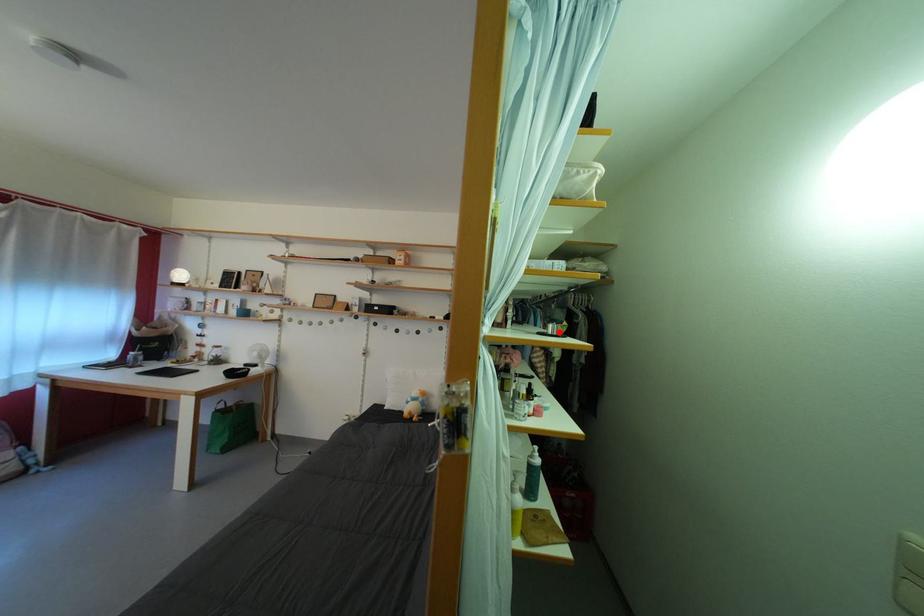
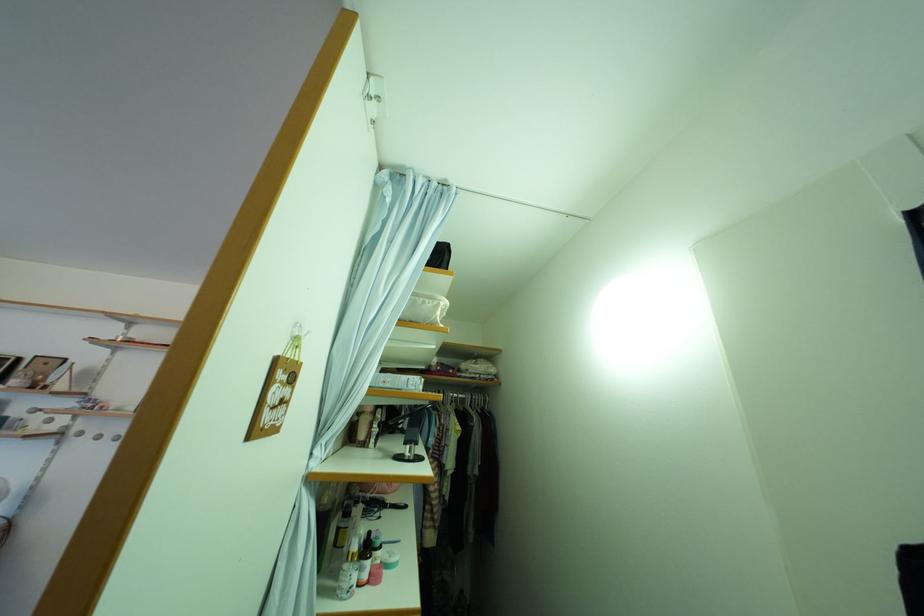
Where in the second image is the point corresponding to the highlighted location from the first image?

(417, 454)